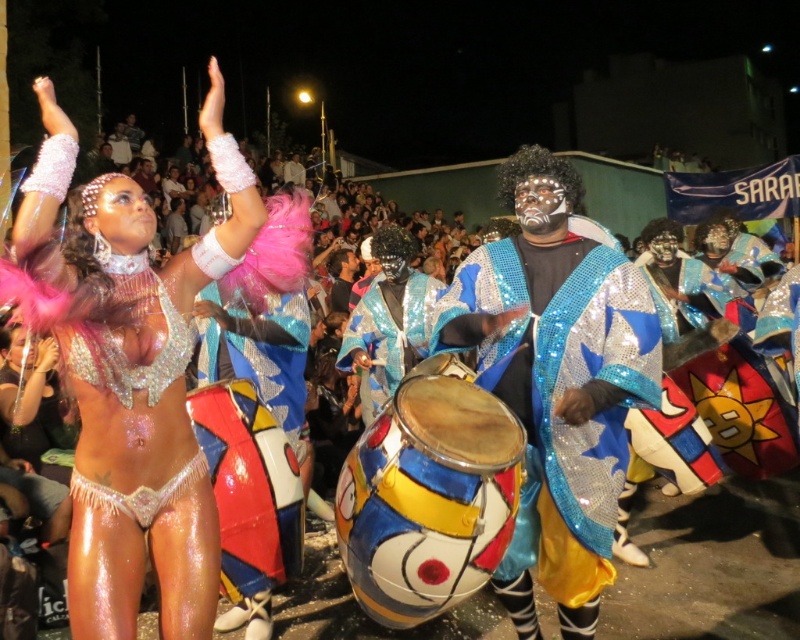
You are a photographer at the carnival. You want to take a photo that includes both the painted wood drum at center and the shiny sequined cape at center. Which object should you focus on first if you want to ensure both are in frame without moving the camera?

The painted wood drum at center is not as tall as the shiny sequined cape at center. Since the drum is shorter, you should focus on the taller shiny sequined cape at center first to ensure the entire height of both objects fits within the frame.

You are standing at the carnival and want to take a photo of the point at coordinates [393,609]. The camera you have can focus on objects within 10 feet. Can you capture a clear photo of that point?

The distance of point [393,609] from the camera is 8.75 feet, which is within the camera focus range of 10 feet. Therefore, you can capture a clear photo of that point.